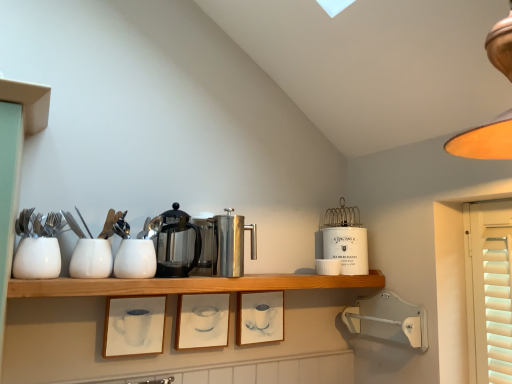
Question: Can you confirm if matte white picture frame at center, which is the 2th picture frame from right to left, is positioned to the left of polished stainless steel coffee pot at center?

Choices:
 (A) yes
 (B) no

Answer: (B)

Question: Does matte white picture frame at center, which is the 2th picture frame from right to left, turn towards polished stainless steel coffee pot at center?

Choices:
 (A) yes
 (B) no

Answer: (B)

Question: Is matte white picture frame at center, which is the 2th picture frame from right to left, closer to camera compared to polished stainless steel coffee pot at center?

Choices:
 (A) yes
 (B) no

Answer: (B)

Question: Is matte white picture frame at center, which is the 2th picture frame from right to left, next to polished stainless steel coffee pot at center and touching it?

Choices:
 (A) yes
 (B) no

Answer: (B)

Question: Is matte white picture frame at center, which is counted as the 2th picture frame, starting from the left, taller than polished stainless steel coffee pot at center?

Choices:
 (A) no
 (B) yes

Answer: (A)

Question: From their relative heights in the image, would you say matte white picture frame at lower center, the 3th picture frame in the right-to-left sequence, is taller or shorter than white matte cup at left, which ranks as the first tableware in left-to-right order?

Choices:
 (A) short
 (B) tall

Answer: (B)

Question: Considering the positions of matte white picture frame at lower center, which is counted as the first picture frame, starting from the left, and white matte cup at left, positioned as the first tableware in front-to-back order, in the image, is matte white picture frame at lower center, which is counted as the first picture frame, starting from the left, wider or thinner than white matte cup at left, positioned as the first tableware in front-to-back order,?

Choices:
 (A) wide
 (B) thin

Answer: (B)

Question: Is matte white picture frame at lower center, the 3th picture frame in the right-to-left sequence, to the left or to the right of white matte cup at left, placed as the fourth tableware when sorted from right to left, in the image?

Choices:
 (A) left
 (B) right

Answer: (B)

Question: From a real-world perspective, is matte white picture frame at lower center, which is counted as the first picture frame, starting from the left, positioned above or below white matte cup at left, which is counted as the 4th tableware, starting from the back?

Choices:
 (A) above
 (B) below

Answer: (B)

Question: Does point (165, 258) appear closer or farther from the camera than point (222, 284)?

Choices:
 (A) farther
 (B) closer

Answer: (A)

Question: From the image's perspective, is polished stainless steel coffee pot at center located above or below wooden shelf at center?

Choices:
 (A) below
 (B) above

Answer: (B)

Question: In terms of width, does polished stainless steel coffee pot at center look wider or thinner when compared to wooden shelf at center?

Choices:
 (A) thin
 (B) wide

Answer: (A)

Question: Is polished stainless steel coffee pot at center taller or shorter than wooden shelf at center?

Choices:
 (A) tall
 (B) short

Answer: (A)

Question: Relative to polished stainless steel coffee press at center, the third appliance viewed from the back, is matte orange lampshade at upper right in front or behind?

Choices:
 (A) behind
 (B) front

Answer: (B)

Question: Considering the positions of matte orange lampshade at upper right and polished stainless steel coffee press at center, the 1th appliance positioned from the front, in the image, is matte orange lampshade at upper right taller or shorter than polished stainless steel coffee press at center, the 1th appliance positioned from the front,?

Choices:
 (A) short
 (B) tall

Answer: (B)